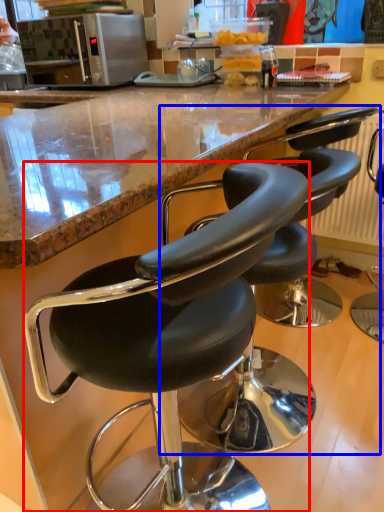
Question: Among these objects, which one is nearest to the camera, chair (highlighted by a red box) or chair (highlighted by a blue box)?

Choices:
 (A) chair
 (B) chair

Answer: (A)